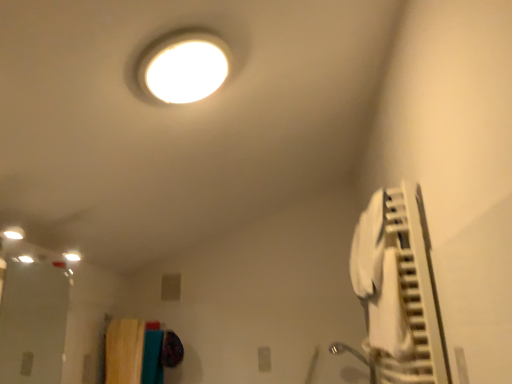
Describe the element at coordinates (139, 352) in the screenshot. The width and height of the screenshot is (512, 384). I see `textured fabric laundry at lower left` at that location.

Where is `transparent glass door at lower left`? transparent glass door at lower left is located at coordinates (33, 323).

Image resolution: width=512 pixels, height=384 pixels. What do you see at coordinates (33, 323) in the screenshot? I see `transparent glass door at lower left` at bounding box center [33, 323].

Image resolution: width=512 pixels, height=384 pixels. In order to click on white fabric air conditioner at right in this screenshot , I will do `click(400, 288)`.

Considering the sizes of objects transparent glass door at lower left and white fabric air conditioner at right in the image provided, who is thinner, transparent glass door at lower left or white fabric air conditioner at right?

Thinner between the two is transparent glass door at lower left.

In the scene shown: From the image's perspective, between transparent glass door at lower left and white fabric air conditioner at right, which one is located above?

white fabric air conditioner at right appears higher in the image.

Could you tell me if transparent glass door at lower left is facing white fabric air conditioner at right?

Yes.

Where is `glass door that appears below the white fabric air conditioner at right (from a real-world perspective)`? The width and height of the screenshot is (512, 384). glass door that appears below the white fabric air conditioner at right (from a real-world perspective) is located at coordinates (33, 323).

Which object is thinner, textured fabric laundry at lower left or transparent glass door at lower left?

transparent glass door at lower left is thinner.

Consider the image. Is textured fabric laundry at lower left oriented away from transparent glass door at lower left?

That's not correct — textured fabric laundry at lower left is not looking away from transparent glass door at lower left.

Who is bigger, textured fabric laundry at lower left or transparent glass door at lower left?

transparent glass door at lower left.

Considering the relative sizes of white fabric air conditioner at right and transparent glass door at lower left in the image provided, is white fabric air conditioner at right smaller than transparent glass door at lower left?

No, white fabric air conditioner at right is not smaller than transparent glass door at lower left.

Which of these two, white fabric air conditioner at right or transparent glass door at lower left, is thinner?

transparent glass door at lower left is thinner.

From the image's perspective, relative to transparent glass door at lower left, is white fabric air conditioner at right above or below?

white fabric air conditioner at right is situated higher than transparent glass door at lower left in the image.

Is white fabric air conditioner at right wider or thinner than textured fabric laundry at lower left?

Clearly, white fabric air conditioner at right has less width compared to textured fabric laundry at lower left.

Based on the photo, considering the positions of objects white fabric air conditioner at right and textured fabric laundry at lower left in the image provided, who is more to the right, white fabric air conditioner at right or textured fabric laundry at lower left?

Positioned to the right is white fabric air conditioner at right.

Is white fabric air conditioner at right positioned far away from textured fabric laundry at lower left?

Yes, white fabric air conditioner at right is far from textured fabric laundry at lower left.

Which point is more distant from viewer, (425, 228) or (106, 383)?

Positioned behind is point (106, 383).

Is textured fabric laundry at lower left smaller than white fabric air conditioner at right?

Yes.

Find the location of a particular element. This screenshot has height=384, width=512. air conditioner in front of the textured fabric laundry at lower left is located at coordinates (400, 288).

Would you consider textured fabric laundry at lower left to be distant from white fabric air conditioner at right?

Yes.

From the image's perspective, would you say textured fabric laundry at lower left is positioned over white fabric air conditioner at right?

Incorrect, from the image's perspective, textured fabric laundry at lower left is lower than white fabric air conditioner at right.

Who is shorter, transparent glass door at lower left or textured fabric laundry at lower left?

Standing shorter between the two is textured fabric laundry at lower left.

Are transparent glass door at lower left and textured fabric laundry at lower left far apart?

No.

Locate an element on the screen. Image resolution: width=512 pixels, height=384 pixels. glass door located above the textured fabric laundry at lower left (from the image's perspective) is located at coordinates (33, 323).

How many degrees apart are the facing directions of transparent glass door at lower left and textured fabric laundry at lower left?

The angular difference between transparent glass door at lower left and textured fabric laundry at lower left is 5.39 degrees.

Identify the location of air conditioner in front of the transparent glass door at lower left. This screenshot has height=384, width=512. (400, 288).

Where is `laundry to the right of transparent glass door at lower left`? laundry to the right of transparent glass door at lower left is located at coordinates (139, 352).

Estimate the real-world distances between objects in this image. Which object is closer to transparent glass door at lower left, white fabric air conditioner at right or textured fabric laundry at lower left?

Based on the image, textured fabric laundry at lower left appears to be nearer to transparent glass door at lower left.

When comparing their distances from textured fabric laundry at lower left, does transparent glass door at lower left or white fabric air conditioner at right seem closer?

transparent glass door at lower left lies closer to textured fabric laundry at lower left than the other object.

In the scene shown: Based on their spatial positions, is textured fabric laundry at lower left or white fabric air conditioner at right closer to transparent glass door at lower left?

Based on the image, textured fabric laundry at lower left appears to be nearer to transparent glass door at lower left.

Considering their positions, is transparent glass door at lower left positioned closer to white fabric air conditioner at right than textured fabric laundry at lower left?

textured fabric laundry at lower left.

When comparing their distances from white fabric air conditioner at right, does textured fabric laundry at lower left or transparent glass door at lower left seem closer?

textured fabric laundry at lower left is positioned closer to the anchor white fabric air conditioner at right.

Which object lies nearer to the anchor point textured fabric laundry at lower left, white fabric air conditioner at right or transparent glass door at lower left?

transparent glass door at lower left lies closer to textured fabric laundry at lower left than the other object.

Image resolution: width=512 pixels, height=384 pixels. I want to click on laundry located between transparent glass door at lower left and white fabric air conditioner at right in the left-right direction, so click(x=139, y=352).